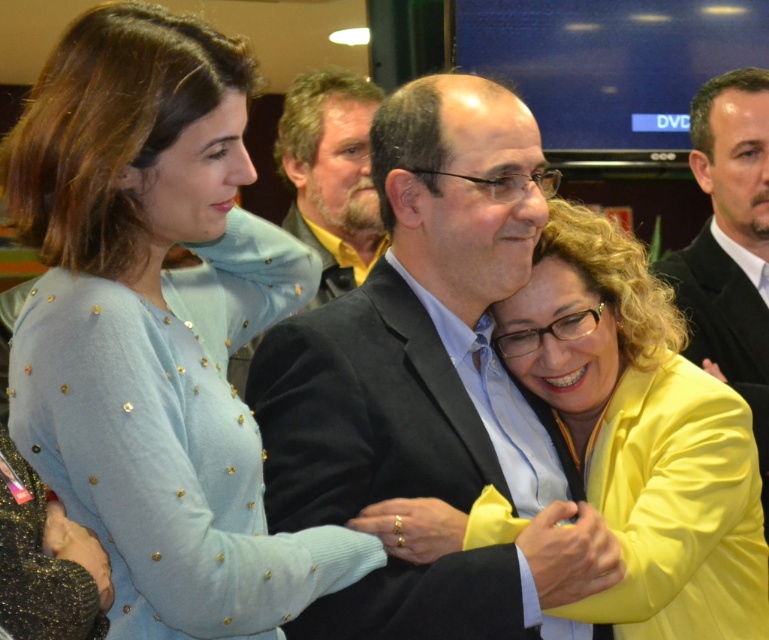
From the picture: Who is shorter, light blue knit sweater at upper left or matte black suit at center?

With less height is light blue knit sweater at upper left.

Does light blue knit sweater at upper left have a lesser width compared to matte black suit at center?

Yes, light blue knit sweater at upper left is thinner than matte black suit at center.

Measure the distance between light blue knit sweater at upper left and camera.

They are 1.13 meters apart.

Where is `light blue knit sweater at upper left`? This screenshot has height=640, width=769. light blue knit sweater at upper left is located at coordinates (157, 326).

From the picture: Who is positioned more to the left, light blue knit sweater at upper left or bearded man at center?

From the viewer's perspective, light blue knit sweater at upper left appears more on the left side.

Does light blue knit sweater at upper left have a smaller size compared to bearded man at center?

No, light blue knit sweater at upper left is not smaller than bearded man at center.

This screenshot has height=640, width=769. I want to click on light blue knit sweater at upper left, so click(157, 326).

Find the location of a particular element. light blue knit sweater at upper left is located at coordinates (157, 326).

Which of these two, yellow matte jacket at center or bearded man at center, stands taller?

Standing taller between the two is yellow matte jacket at center.

Where is `yellow matte jacket at center`? The width and height of the screenshot is (769, 640). yellow matte jacket at center is located at coordinates (641, 435).